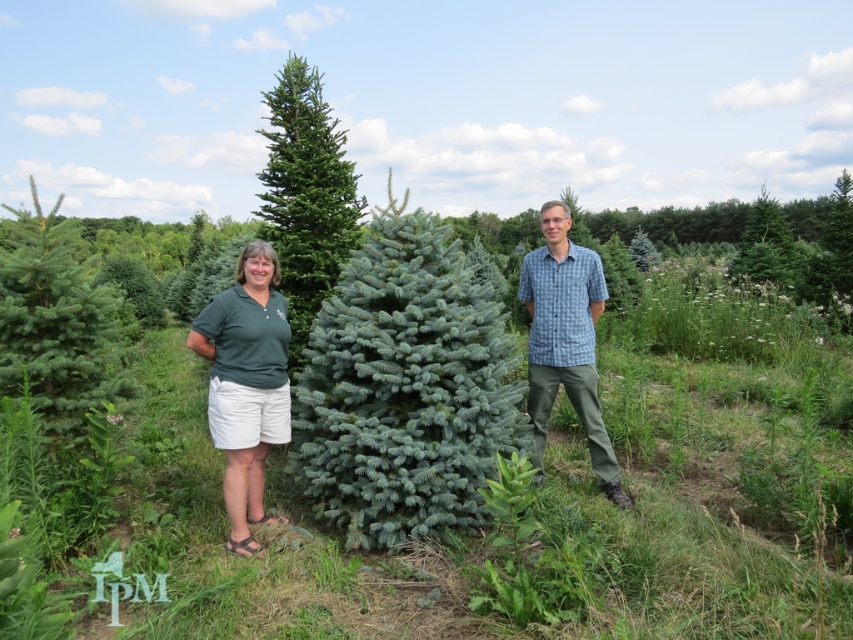
Can you confirm if green fabric shirt at left is thinner than blue plaid shirt at center?

Yes.

Who is more distant from viewer, (225, 314) or (601, 289)?

Positioned behind is point (601, 289).

Which is behind, point (239, 520) or point (554, 205)?

The point (554, 205) is more distant.

You are a GUI agent. You are given a task and a screenshot of the screen. Output one action in this format:
    pyautogui.click(x=<x>, y=<y>)
    Task: Click on the green fabric shirt at left
    This screenshot has width=853, height=640.
    Given the screenshot: What is the action you would take?
    pyautogui.click(x=247, y=385)

Who is lower down, green needle-like at center or blue plaid shirt at center?

blue plaid shirt at center is below.

Does green needle-like at center have a greater width compared to blue plaid shirt at center?

Yes.

Where is `green needle-like at center`? The image size is (853, 640). green needle-like at center is located at coordinates (306, 196).

Image resolution: width=853 pixels, height=640 pixels. Identify the location of green needle-like at center. (306, 196).

Does point (283, 96) come in front of point (282, 401)?

No, it is not.

What do you see at coordinates (306, 196) in the screenshot?
I see `green needle-like at center` at bounding box center [306, 196].

Is point (322, 294) positioned before point (231, 428)?

No, (322, 294) is behind (231, 428).

Locate an element on the screen. green needle-like at center is located at coordinates click(x=306, y=196).